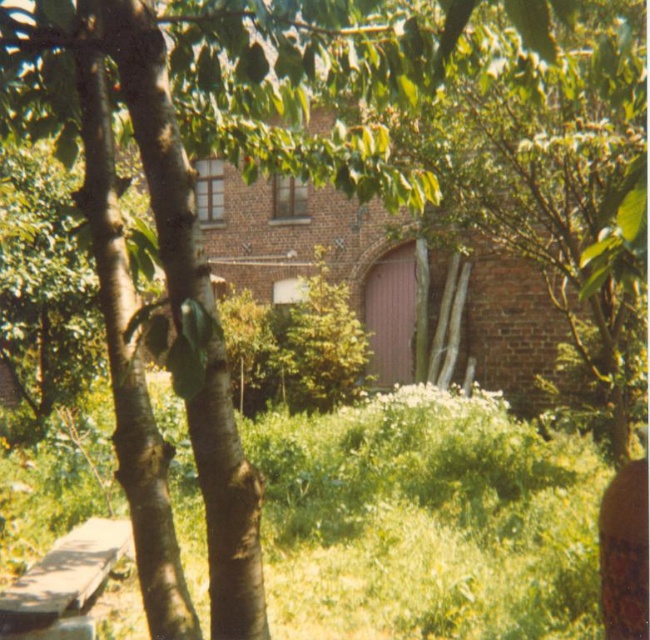
You are standing in front of the brick building and notice two points marked in the image. The first point is at coordinates point (400, 416) and the second is at point (640, 554). Which point is closer to you?

Point (400, 416) is further to the camera than point (640, 554). Wait, the question asks which is closer to you. Since point (400, 416) is further away, then the closer one would be point (640, 554). Hmm, but the description says the first point is further than the second. So the second point is closer. Therefore, the answer should state that point (640, 554) is closer because it is less further away. Alternatively, rephrase the answer to clearly state the comparison based on the description.

You are standing in the rural scene and see the green grass at center and the brown leather bottle at lower right. Which object is positioned to the left of the other?

The green grass at center is to the left of brown leather bottle at lower right.

Looking at this image, you are standing in a rural area and see the brick building partially hidden by trees. There is a specific point marked at coordinates (426, 522). What can you find at that exact location?

At point (426, 522), there is green grass at center.